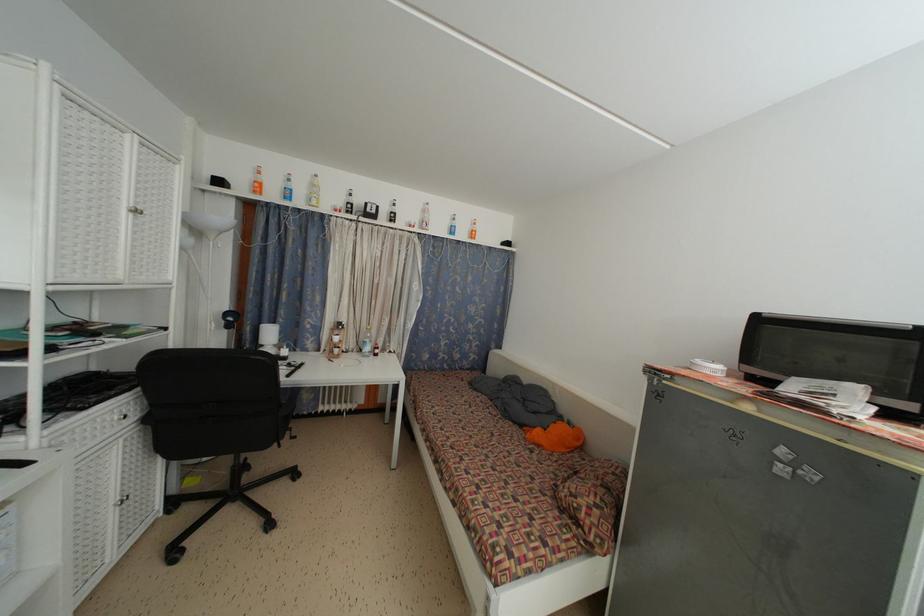
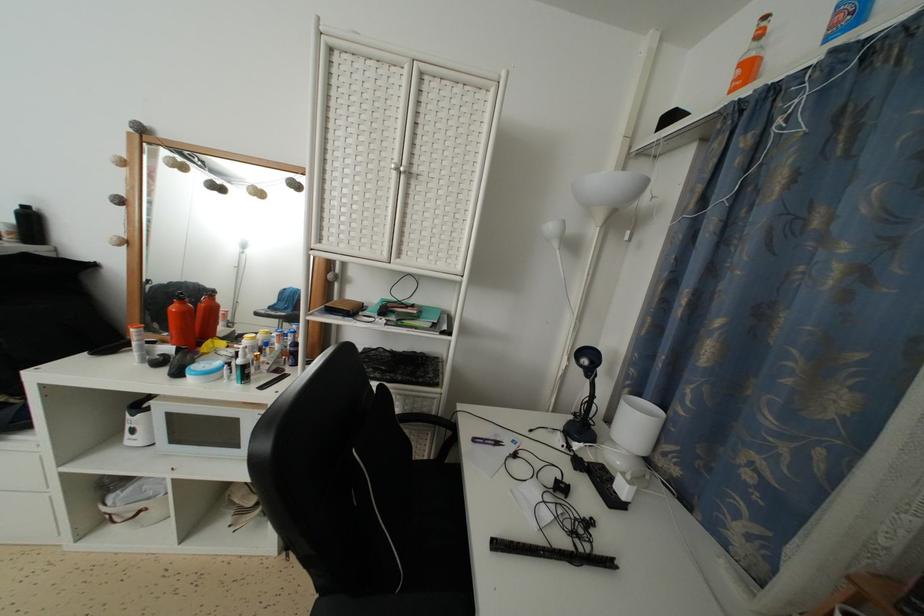
In the second image, find the point that corresponds to the point at 306,370 in the first image.

(614, 569)